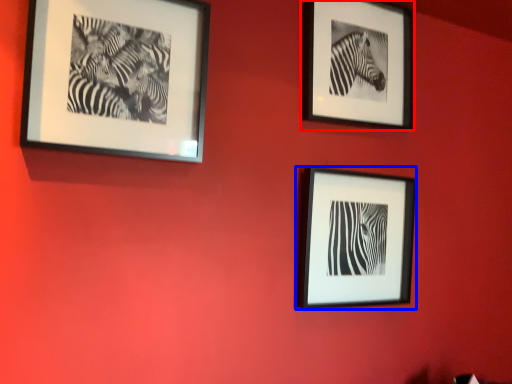
Question: Among these objects, which one is farthest to the camera, picture frame (highlighted by a red box) or picture frame (highlighted by a blue box)?

Choices:
 (A) picture frame
 (B) picture frame

Answer: (A)